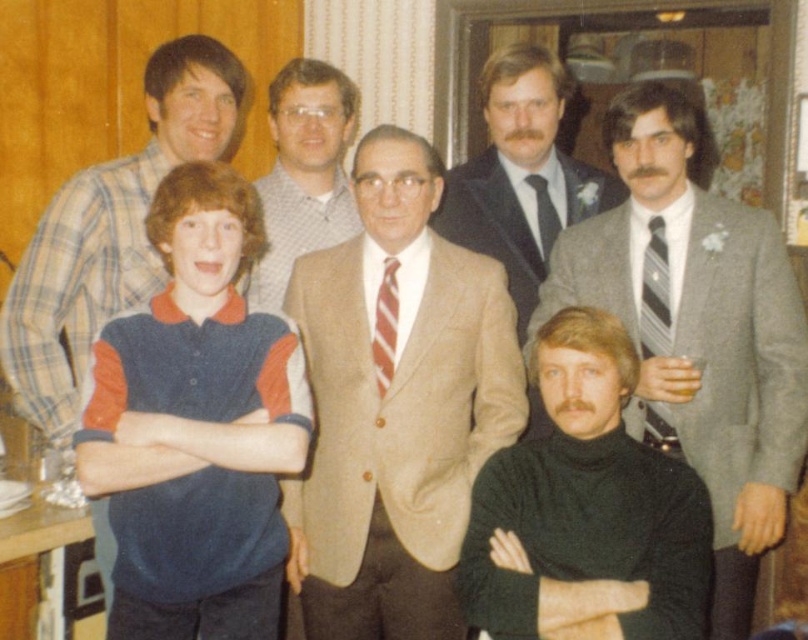
Question: Which of these objects is positioned closest to the plaid shirt at left?

Choices:
 (A) dark brown suit at center
 (B) striped fabric tie at center

Answer: (B)

Question: Observing the image, what is the correct spatial positioning of checkered fabric shirt at center in reference to smooth gray suit at center?

Choices:
 (A) left
 (B) right

Answer: (A)

Question: Estimate the real-world distances between objects in this image. Which object is closer to the checkered fabric shirt at center?

Choices:
 (A) gray wool suit at right
 (B) tan wool suit at center

Answer: (B)

Question: Does gray wool suit at right have a lesser width compared to striped fabric tie at right?

Choices:
 (A) no
 (B) yes

Answer: (A)

Question: Estimate the real-world distances between objects in this image. Which object is closer to the gray wool coat at right?

Choices:
 (A) striped fabric tie at center
 (B) tan wool suit at center
 (C) striped fabric tie at right
 (D) dark green turtleneck sweater at lower right

Answer: (C)

Question: Is gray wool suit at right bigger than dark brown suit at center?

Choices:
 (A) yes
 (B) no

Answer: (A)